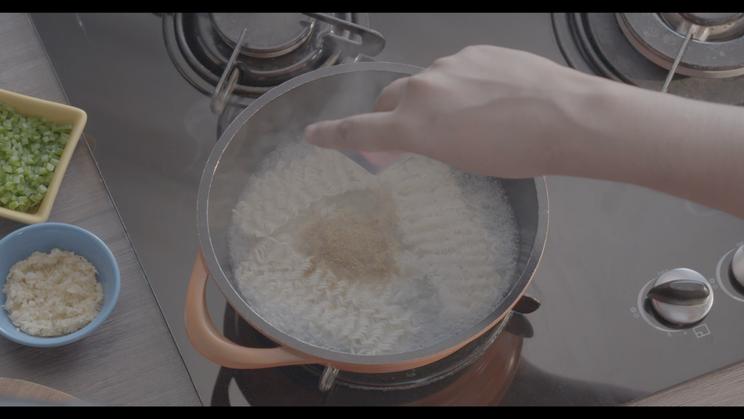
Locate an element on the screen. This screenshot has width=744, height=419. stove top is located at coordinates (132, 53).